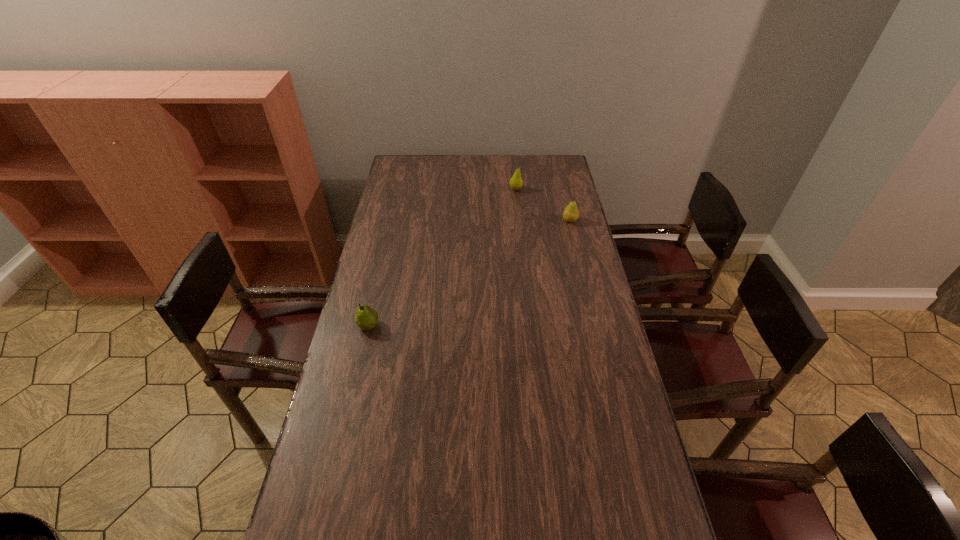
I want to click on the second object from right to left, so click(x=516, y=182).

Locate an element on the screen. The width and height of the screenshot is (960, 540). the farthest object is located at coordinates (516, 182).

This screenshot has height=540, width=960. I want to click on the second nearest pear, so click(571, 213).

Identify the location of the second farthest object. This screenshot has width=960, height=540. (571, 213).

This screenshot has height=540, width=960. Find the location of `the leftmost pear`. the leftmost pear is located at coordinates (366, 318).

The width and height of the screenshot is (960, 540). Find the location of `the nearest pear`. the nearest pear is located at coordinates (366, 318).

Locate an element on the screen. vacant space located 0.370m on the left of the farthest pear is located at coordinates (431, 190).

Identify the location of vacant space located 0.170m on the left of the second nearest object. (522, 221).

Locate an element on the screen. The height and width of the screenshot is (540, 960). vacant space located on the back of the nearest object is located at coordinates (388, 243).

Where is `object that is at the left edge`? object that is at the left edge is located at coordinates (366, 318).